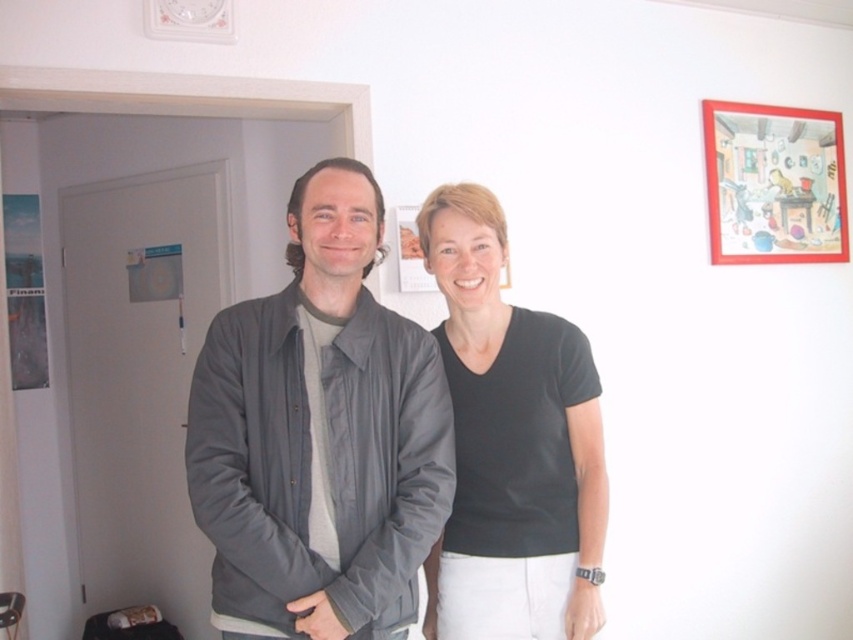
You are trying to hang a picture between the gray fabric jacket at center and the black matte shirt at center. Which object should you place the picture above to ensure it is higher?

The black matte shirt at center is taller than the gray fabric jacket at center, so you should place the picture above the black matte shirt at center to ensure it is higher.

In the scene shown: You are a photographer adjusting your camera settings. You notice the gray fabric jacket at center and the black matte shirt at center. Which object should you focus on first to ensure both are in sharp focus, considering their positions?

The gray fabric jacket at center is closer to the viewer than the black matte shirt at center, so you should focus on the gray fabric jacket at center first to ensure both are in sharp focus.

You are a photographer setting up for a group photo. You have a camera that can capture objects up to 1 meter wide. You need to ensure both the gray fabric jacket at center and the matte red picture frame at upper right are fully in frame. Given their widths, will both fit within the camera view?

The gray fabric jacket at center is narrower than the matte red picture frame at upper right. Since the camera can capture up to 1 meter, both objects will fit as long as the widest object, the matte red picture frame at upper right, is within the 1 meter limit. However, without knowing the exact width of the matte red picture frame at upper right, we cannot confirm if it exceeds the camera limit.